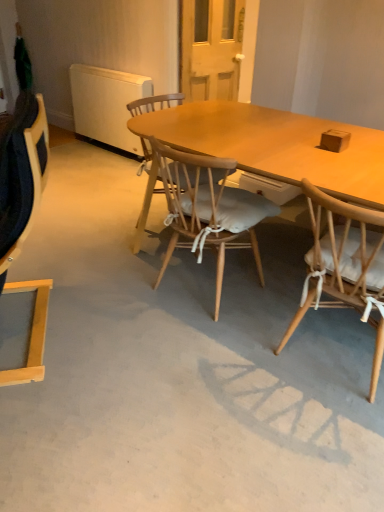
Question: From the image's perspective, is light wood chair at left, placed as the first chair when sorted from left to right, above brown matte box at upper right?

Choices:
 (A) yes
 (B) no

Answer: (B)

Question: Is light wood chair at left, marked as the third chair in a right-to-left arrangement, smaller than brown matte box at upper right?

Choices:
 (A) yes
 (B) no

Answer: (B)

Question: Is light wood chair at left, marked as the third chair in a right-to-left arrangement, wider than brown matte box at upper right?

Choices:
 (A) yes
 (B) no

Answer: (A)

Question: Can you confirm if light wood chair at left, marked as the third chair in a right-to-left arrangement, is thinner than brown matte box at upper right?

Choices:
 (A) yes
 (B) no

Answer: (B)

Question: Is the depth of light wood chair at left, placed as the first chair when sorted from left to right, less than that of brown matte box at upper right?

Choices:
 (A) yes
 (B) no

Answer: (A)

Question: From the image's perspective, would you say light wood chair at left, marked as the third chair in a right-to-left arrangement, is positioned over wooden chair with white cushion at right, the 3th chair from the left?

Choices:
 (A) no
 (B) yes

Answer: (B)

Question: Does light wood chair at left, placed as the first chair when sorted from left to right, appear on the right side of wooden chair with white cushion at right, placed as the 1th chair when sorted from right to left?

Choices:
 (A) no
 (B) yes

Answer: (A)

Question: From a real-world perspective, is light wood chair at left, placed as the first chair when sorted from left to right, on wooden chair with white cushion at right, the 3th chair from the left?

Choices:
 (A) no
 (B) yes

Answer: (B)

Question: Are light wood chair at left, placed as the first chair when sorted from left to right, and wooden chair with white cushion at right, placed as the 1th chair when sorted from right to left, far apart?

Choices:
 (A) yes
 (B) no

Answer: (A)

Question: Is light wood chair at left, marked as the third chair in a right-to-left arrangement, wider than wooden chair with white cushion at right, the 3th chair from the left?

Choices:
 (A) no
 (B) yes

Answer: (A)

Question: Is light wood chair at left, marked as the third chair in a right-to-left arrangement, in front of wooden chair with white cushion at right, the 3th chair from the left?

Choices:
 (A) yes
 (B) no

Answer: (A)

Question: Could you tell me if brown matte box at upper right is facing wooden chair with white cushion at right, the 3th chair from the left?

Choices:
 (A) no
 (B) yes

Answer: (A)